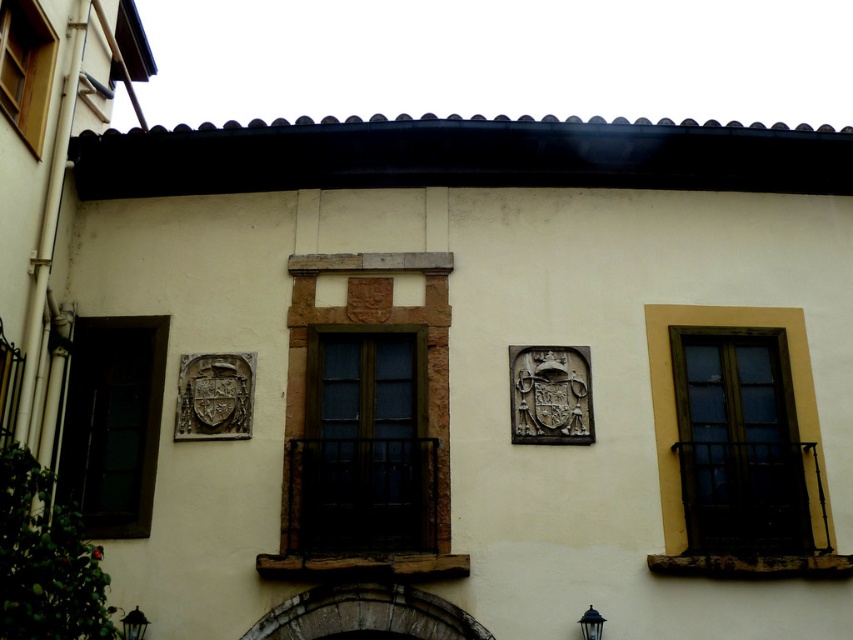
Based on the scene description, which window is wider, the dark glass window at left or the wooden window at upper left?

The dark glass window at left is wider than the wooden window at upper left according to the description.